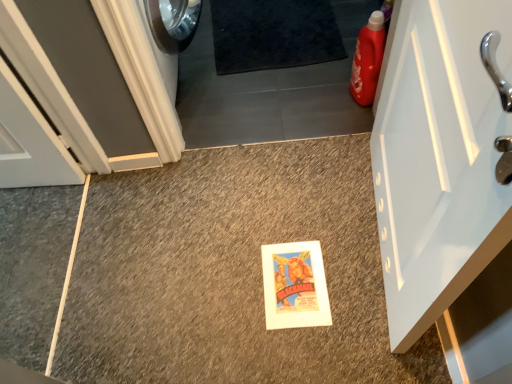
I want to click on white glossy door at right, which is counted as the 2th door, starting from the left, so click(439, 158).

I want to click on black shaggy carpet at upper center, so click(273, 34).

This screenshot has height=384, width=512. I want to click on white painted wood door at left, the first door positioned from the left, so tap(78, 94).

From a real-world perspective, is matte plastic detergent at right physically above white painted wood door at left, which is counted as the second door, starting from the right?

No.

Which is behind, matte plastic detergent at right or white painted wood door at left, which is counted as the second door, starting from the right?

matte plastic detergent at right is further away from the camera.

Can you confirm if matte plastic detergent at right is taller than white painted wood door at left, which is counted as the second door, starting from the right?

Incorrect, the height of matte plastic detergent at right is not larger of that of white painted wood door at left, which is counted as the second door, starting from the right.

Are matte plastic detergent at right and white painted wood door at left, the first door positioned from the left, located far from each other?

Yes, matte plastic detergent at right is far from white painted wood door at left, the first door positioned from the left.

From the image's perspective, does matte plastic detergent at right appear lower than black shaggy carpet at upper center?

Yes, from the image's perspective, matte plastic detergent at right is below black shaggy carpet at upper center.

Is matte plastic detergent at right to the right of black shaggy carpet at upper center from the viewer's perspective?

Yes, matte plastic detergent at right is to the right of black shaggy carpet at upper center.

Which object is further away from the camera, matte plastic detergent at right or black shaggy carpet at upper center?

black shaggy carpet at upper center is behind.

From the image's perspective, relative to white glossy door at right, positioned as the 1th door in right-to-left order, is matte plastic detergent at right above or below?

From the image's perspective, matte plastic detergent at right appears above white glossy door at right, positioned as the 1th door in right-to-left order.

Would you say white glossy door at right, positioned as the 1th door in right-to-left order, is part of matte plastic detergent at right's contents?

No.

Is matte plastic detergent at right facing away from white glossy door at right, positioned as the 1th door in right-to-left order?

No, matte plastic detergent at right is not facing away from white glossy door at right, positioned as the 1th door in right-to-left order.

Considering the relative sizes of matte plastic detergent at right and white glossy door at right, positioned as the 1th door in right-to-left order, in the image provided, is matte plastic detergent at right taller than white glossy door at right, positioned as the 1th door in right-to-left order,?

In fact, matte plastic detergent at right may be shorter than white glossy door at right, positioned as the 1th door in right-to-left order.

Which is behind, point (77, 42) or point (372, 92)?

The point (372, 92) is farther from the camera.

Considering the relative sizes of white painted wood door at left, which is counted as the second door, starting from the right, and matte plastic detergent at right in the image provided, is white painted wood door at left, which is counted as the second door, starting from the right, smaller than matte plastic detergent at right?

No.

From a real-world perspective, is white painted wood door at left, the first door positioned from the left, located higher than matte plastic detergent at right?

Indeed, from a real-world perspective, white painted wood door at left, the first door positioned from the left, stands above matte plastic detergent at right.

From the image's perspective, would you say white painted wood door at left, the first door positioned from the left, is shown under matte plastic detergent at right?

No, from the image's perspective, white painted wood door at left, the first door positioned from the left, is not beneath matte plastic detergent at right.

Does point (215, 16) lie behind point (463, 141)?

Yes, it is behind point (463, 141).

Is white glossy door at right, positioned as the 1th door in right-to-left order, completely or partially inside black shaggy carpet at upper center?

Actually, white glossy door at right, positioned as the 1th door in right-to-left order, is outside black shaggy carpet at upper center.

From the image's perspective, would you say black shaggy carpet at upper center is shown under white glossy door at right, which is counted as the 2th door, starting from the left?

Incorrect, from the image's perspective, black shaggy carpet at upper center is higher than white glossy door at right, which is counted as the 2th door, starting from the left.

Considering the sizes of objects black shaggy carpet at upper center and white glossy door at right, which is counted as the 2th door, starting from the left, in the image provided, who is thinner, black shaggy carpet at upper center or white glossy door at right, which is counted as the 2th door, starting from the left,?

With smaller width is white glossy door at right, which is counted as the 2th door, starting from the left.

Does point (253, 9) lie behind point (61, 79)?

That is True.

From a real-world perspective, between black shaggy carpet at upper center and white painted wood door at left, the first door positioned from the left, who is vertically lower?

From a 3D spatial view, black shaggy carpet at upper center is below.

Is black shaggy carpet at upper center turned away from white painted wood door at left, the first door positioned from the left?

No.

Looking at the image, does black shaggy carpet at upper center seem bigger or smaller compared to white painted wood door at left, the first door positioned from the left?

Clearly, black shaggy carpet at upper center is smaller in size than white painted wood door at left, the first door positioned from the left.

Which is behind, point (77, 49) or point (438, 160)?

The point (77, 49) is more distant.

From a real-world perspective, which object stands above the other?

From a 3D spatial view, white glossy door at right, which is counted as the 2th door, starting from the left, is above.

Considering the sizes of objects white painted wood door at left, the first door positioned from the left, and white glossy door at right, positioned as the 1th door in right-to-left order, in the image provided, who is taller, white painted wood door at left, the first door positioned from the left, or white glossy door at right, positioned as the 1th door in right-to-left order,?

white glossy door at right, positioned as the 1th door in right-to-left order, is taller.

Is the depth of white painted wood door at left, which is counted as the second door, starting from the right, greater than that of white glossy door at right, which is counted as the 2th door, starting from the left?

That is True.

At what (x,y) coordinates should I click in order to perform the action: click on cleaning product below the white painted wood door at left, the first door positioned from the left (from a real-world perspective). Please return your answer as a coordinate pair (x, y). Looking at the image, I should click on (368, 59).

Identify the location of cleaning product on the right of black shaggy carpet at upper center. (368, 59).

From the image, which object appears to be nearer to matte plastic detergent at right, white painted wood door at left, the first door positioned from the left, or black shaggy carpet at upper center?

Based on the image, black shaggy carpet at upper center appears to be nearer to matte plastic detergent at right.

Based on their spatial positions, is white painted wood door at left, which is counted as the second door, starting from the right, or white glossy door at right, which is counted as the 2th door, starting from the left, further from black shaggy carpet at upper center?

The object further to black shaggy carpet at upper center is white glossy door at right, which is counted as the 2th door, starting from the left.

Which object lies further to the anchor point matte plastic detergent at right, white painted wood door at left, the first door positioned from the left, or white glossy door at right, positioned as the 1th door in right-to-left order?

white painted wood door at left, the first door positioned from the left, is positioned further to the anchor matte plastic detergent at right.

From the image, which object appears to be farther from black shaggy carpet at upper center, white glossy door at right, which is counted as the 2th door, starting from the left, or white painted wood door at left, the first door positioned from the left?

The object further to black shaggy carpet at upper center is white glossy door at right, which is counted as the 2th door, starting from the left.

Based on their spatial positions, is matte plastic detergent at right or white glossy door at right, which is counted as the 2th door, starting from the left, further from white painted wood door at left, which is counted as the second door, starting from the right?

Among the two, matte plastic detergent at right is located further to white painted wood door at left, which is counted as the second door, starting from the right.

From the image, which object appears to be nearer to black shaggy carpet at upper center, matte plastic detergent at right or white painted wood door at left, the first door positioned from the left?

Among the two, matte plastic detergent at right is located nearer to black shaggy carpet at upper center.

When comparing their distances from white painted wood door at left, the first door positioned from the left, does white glossy door at right, which is counted as the 2th door, starting from the left, or matte plastic detergent at right seem closer?

The object closer to white painted wood door at left, the first door positioned from the left, is white glossy door at right, which is counted as the 2th door, starting from the left.

Looking at the image, which one is located further to white glossy door at right, which is counted as the 2th door, starting from the left, black shaggy carpet at upper center or matte plastic detergent at right?

black shaggy carpet at upper center lies further to white glossy door at right, which is counted as the 2th door, starting from the left, than the other object.

At what (x,y) coordinates should I click in order to perform the action: click on cleaning product between white glossy door at right, which is counted as the 2th door, starting from the left, and black shaggy carpet at upper center in the front-back direction. Please return your answer as a coordinate pair (x, y). This screenshot has width=512, height=384. Looking at the image, I should click on (368, 59).

Locate an element on the screen. This screenshot has width=512, height=384. door between white glossy door at right, positioned as the 1th door in right-to-left order, and black shaggy carpet at upper center, along the z-axis is located at coordinates (78, 94).

Find the location of a particular element. Image resolution: width=512 pixels, height=384 pixels. door between white glossy door at right, which is counted as the 2th door, starting from the left, and matte plastic detergent at right, along the z-axis is located at coordinates (78, 94).

The height and width of the screenshot is (384, 512). Find the location of `bath mat between white painted wood door at left, which is counted as the second door, starting from the right, and matte plastic detergent at right from left to right`. bath mat between white painted wood door at left, which is counted as the second door, starting from the right, and matte plastic detergent at right from left to right is located at coordinates (273, 34).